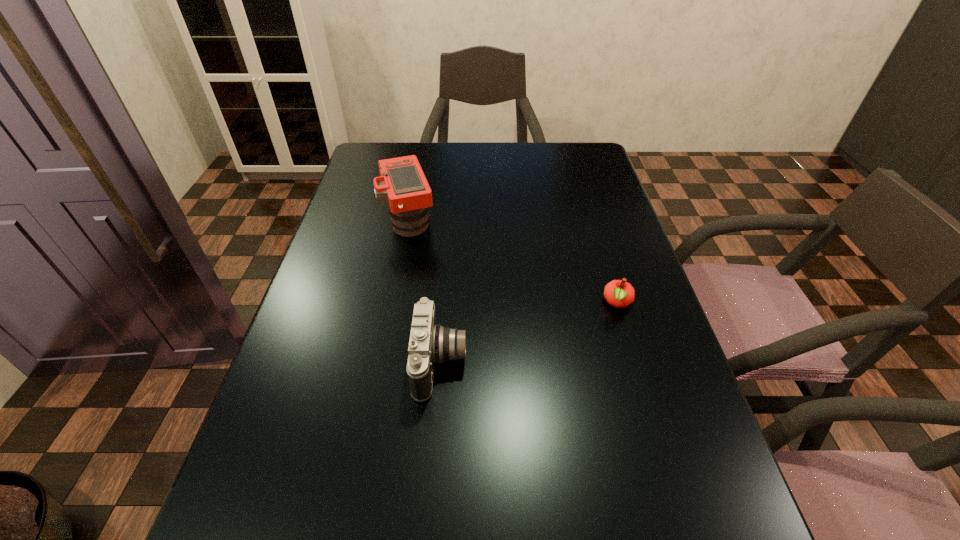
Where is `the taller camera`? The width and height of the screenshot is (960, 540). the taller camera is located at coordinates (402, 185).

I want to click on the farther camera, so click(402, 185).

At what (x,y) coordinates should I click in order to perform the action: click on the nearest object. Please return your answer as a coordinate pair (x, y). Looking at the image, I should click on coord(430,343).

Where is `the nearer camera`? the nearer camera is located at coordinates (430, 343).

Image resolution: width=960 pixels, height=540 pixels. I want to click on the shortest object, so click(x=618, y=293).

The image size is (960, 540). In order to click on the rightmost object in this screenshot , I will do `click(618, 293)`.

At what (x,y) coordinates should I click in order to perform the action: click on vacant space located on the front of the taller camera. Please return your answer as a coordinate pair (x, y). The width and height of the screenshot is (960, 540). Looking at the image, I should click on (401, 261).

Find the location of a particular element. free space located 0.220m on the front-facing side of the nearest object is located at coordinates (576, 362).

Where is `free space located on the back of the apple`? The image size is (960, 540). free space located on the back of the apple is located at coordinates (606, 261).

Locate an element on the screen. Image resolution: width=960 pixels, height=540 pixels. object located at the left edge is located at coordinates (402, 185).